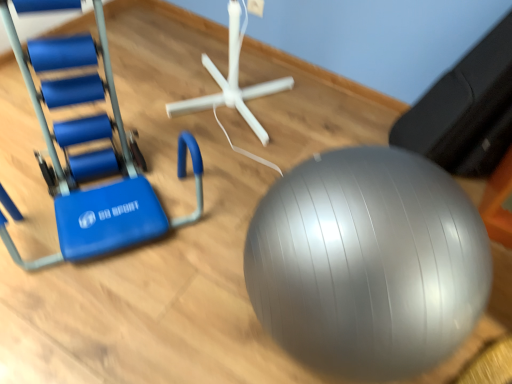
Question: Choose the correct answer: Is silver rubber ball at center inside blue rubber swivel chair at left or outside it?

Choices:
 (A) inside
 (B) outside

Answer: (B)

Question: Is silver rubber ball at center in front of or behind blue rubber swivel chair at left in the image?

Choices:
 (A) front
 (B) behind

Answer: (A)

Question: Based on their sizes in the image, would you say silver rubber ball at center is bigger or smaller than blue rubber swivel chair at left?

Choices:
 (A) small
 (B) big

Answer: (A)

Question: From their relative heights in the image, would you say blue rubber swivel chair at left is taller or shorter than silver rubber ball at center?

Choices:
 (A) tall
 (B) short

Answer: (A)

Question: Considering the relative positions of blue rubber swivel chair at left and silver rubber ball at center in the image provided, is blue rubber swivel chair at left to the left or to the right of silver rubber ball at center?

Choices:
 (A) left
 (B) right

Answer: (A)

Question: From a real-world perspective, is blue rubber swivel chair at left above or below silver rubber ball at center?

Choices:
 (A) below
 (B) above

Answer: (B)

Question: Is point (74, 127) closer or farther from the camera than point (472, 292)?

Choices:
 (A) farther
 (B) closer

Answer: (A)